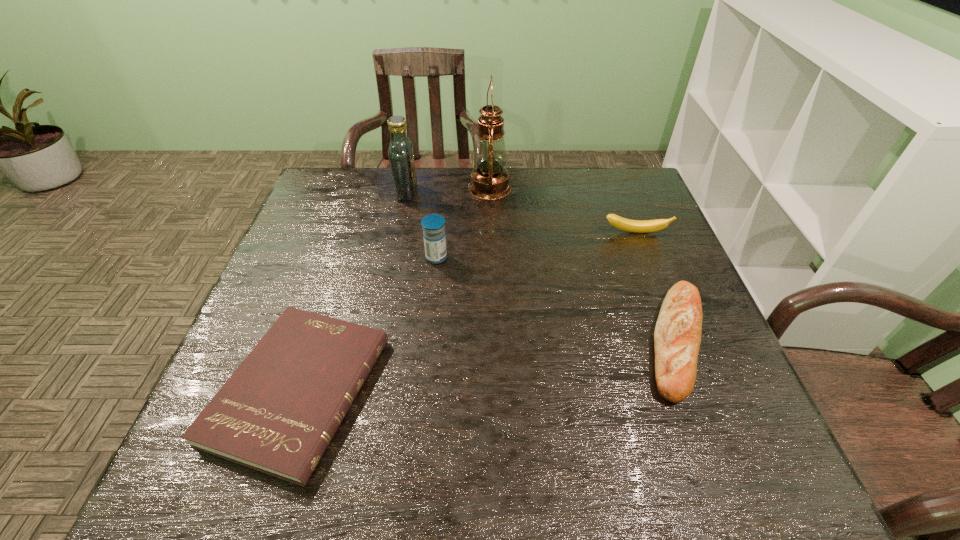
Identify the location of vacant space located 0.210m on the front of the fourth farthest object. (429, 330).

What are the coordinates of `blank space located at the stem of the banana` in the screenshot? It's located at (657, 287).

I want to click on free space located on the back of the baguet, so click(x=648, y=268).

The width and height of the screenshot is (960, 540). Identify the location of vacant area situated 0.220m on the back of the shortest object. (344, 253).

Where is `oil lamp that is at the far edge`? oil lamp that is at the far edge is located at coordinates (489, 179).

At what (x,y) coordinates should I click in order to perform the action: click on vodka at the far edge. Please return your answer as a coordinate pair (x, y). The width and height of the screenshot is (960, 540). Looking at the image, I should click on (400, 153).

At what (x,y) coordinates should I click in order to perform the action: click on object at the near edge. Please return your answer as a coordinate pair (x, y). The width and height of the screenshot is (960, 540). Looking at the image, I should click on click(277, 413).

I want to click on object that is positioned at the left edge, so click(x=277, y=413).

This screenshot has height=540, width=960. I want to click on banana positioned at the right edge, so click(x=638, y=226).

Locate an element on the screen. The image size is (960, 540). baguet located at the right edge is located at coordinates point(677,336).